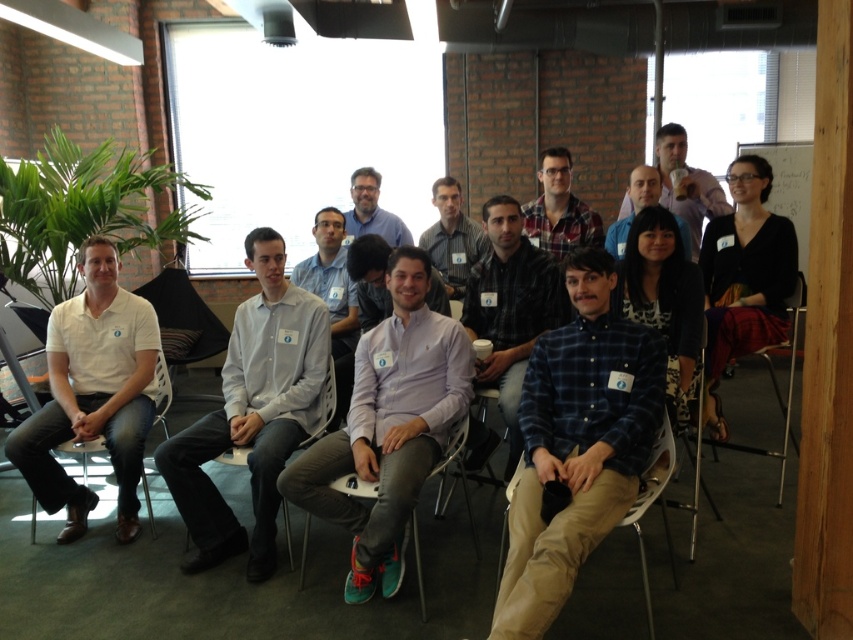
Consider the image. You are organizing a photo shoot and need to ensure that the light gray shirt at center and the white plastic chair at center are both visible in the frame. Given their sizes, which object should you prioritize positioning closer to the camera to maintain clarity?

The light gray shirt at center should be positioned closer to the camera since it has a lesser width compared to the white plastic chair at center, ensuring its details remain clear in the photo.

From the picture: You are organizing a group photo and need to arrange the participants in a row based on their shirt widths. Given that you have the plaid flannel shirt at center and the matte blue shirt at center in front of you, which shirt should be placed to the left to maintain proper width order from widest to narrowest?

The plaid flannel shirt at center should be placed to the left of the matte blue shirt at center since it is wider, ensuring the order from widest to narrowest from left to right.